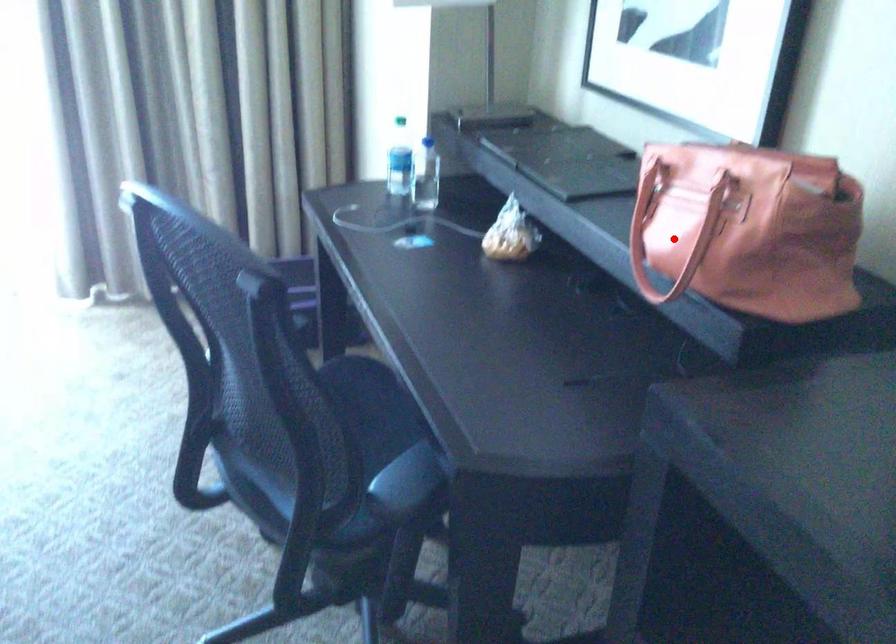
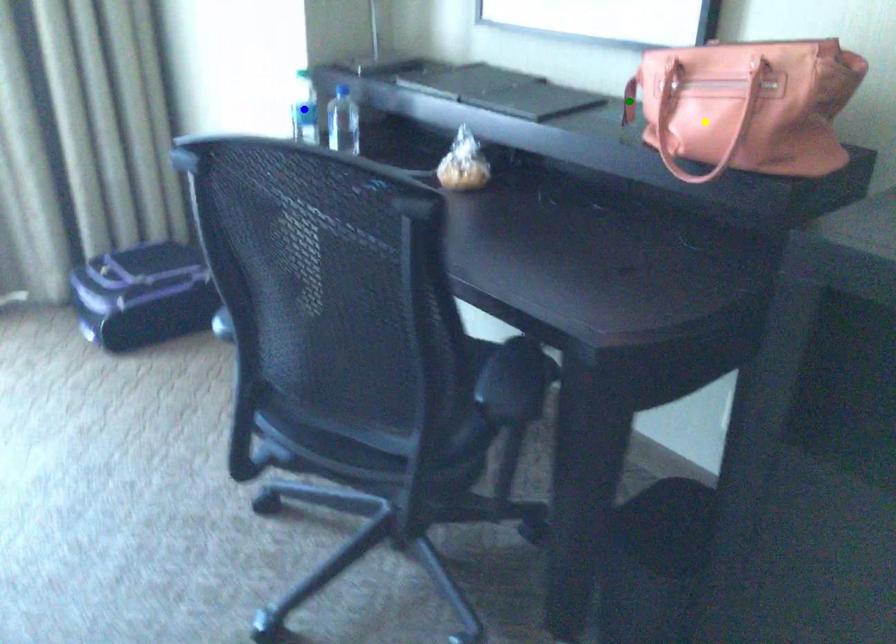
Question: I am providing you with two images of the same scene from different viewpoints. A red point is marked on the first image. You are given multiple points on the second image. Which point in image 2 is actually the same real-world point as the red point in image 1?

Choices:
 (A) green point
 (B) yellow point
 (C) blue point

Answer: (B)